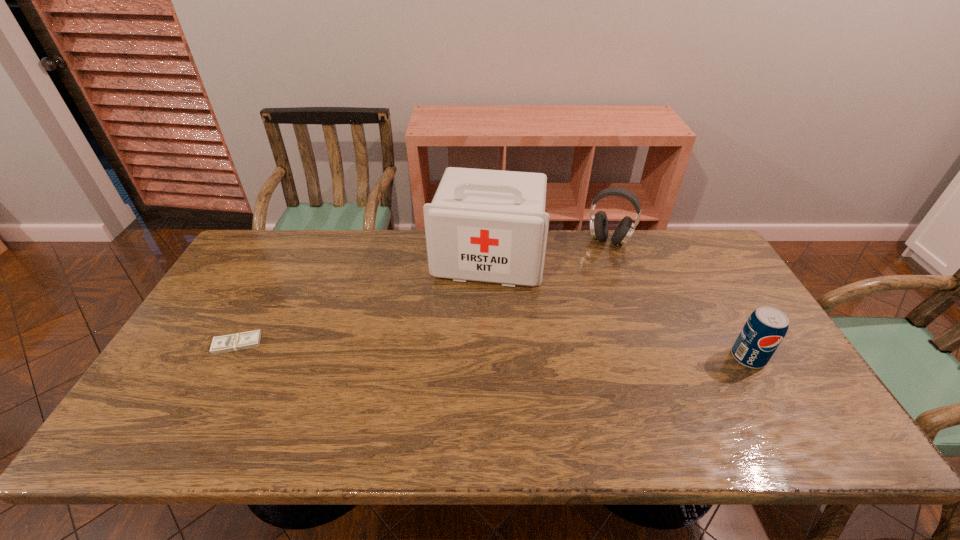
Locate an element on the screen. The image size is (960, 540). vacant area that lies between the second shortest object and the third object from left to right is located at coordinates (679, 299).

The width and height of the screenshot is (960, 540). I want to click on empty space that is in between the third object from left to right and the shortest object, so click(423, 292).

In order to click on unoccupied area between the tallest object and the headset in this screenshot , I will do click(x=548, y=249).

You are a GUI agent. You are given a task and a screenshot of the screen. Output one action in this format:
    pyautogui.click(x=<x>, y=<y>)
    Task: Click on the vacant space in between the third shortest object and the leftmost object
    
    Given the screenshot: What is the action you would take?
    pyautogui.click(x=423, y=292)

Identify the location of vacant space that's between the shortest object and the tallest object. (363, 301).

Locate an element on the screen. vacant point located between the first-aid kit and the second object from right to left is located at coordinates (548, 249).

Find the location of a particular element. The width and height of the screenshot is (960, 540). object that is the third closest to the headset is located at coordinates pos(239,341).

This screenshot has width=960, height=540. What are the coordinates of `object that is the closest to the first-aid kit` in the screenshot? It's located at (599, 228).

You are a GUI agent. You are given a task and a screenshot of the screen. Output one action in this format:
    pyautogui.click(x=<x>, y=<y>)
    Task: Click on the free spot that satisfies the following two spatial constraints: 1. on the back side of the second object from left to right; 2. on the right side of the money
    The height and width of the screenshot is (540, 960).
    Given the screenshot: What is the action you would take?
    pyautogui.click(x=283, y=258)